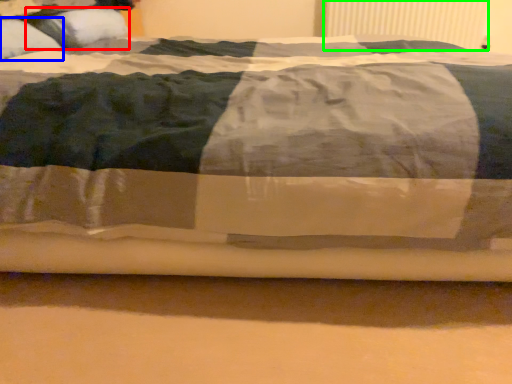
Question: Which object is the closest to the pillow (highlighted by a red box)? Choose among these: pillow (highlighted by a blue box) or radiator (highlighted by a green box).

Choices:
 (A) pillow
 (B) radiator

Answer: (A)